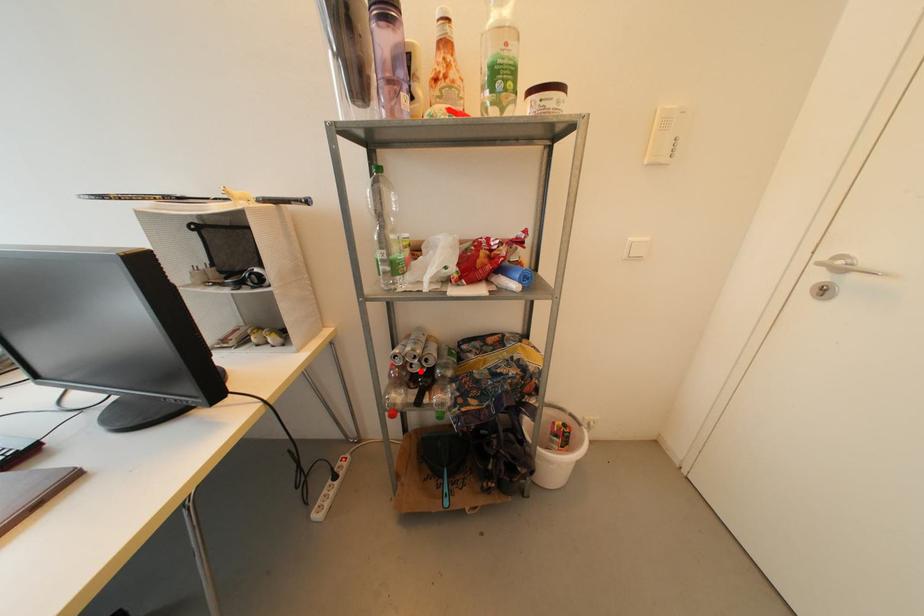
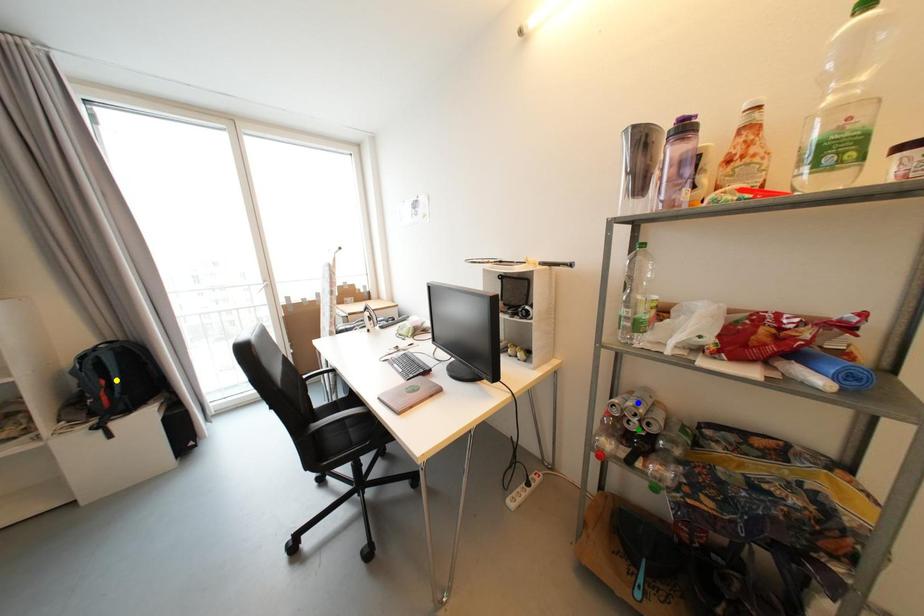
Question: I am providing you with two images of the same scene from different viewpoints. A red point is marked on the first image. You are given multiple points on the second image. Which mark in image 2 goes with the point in image 1?

Choices:
 (A) blue point
 (B) yellow point
 (C) green point

Answer: (C)